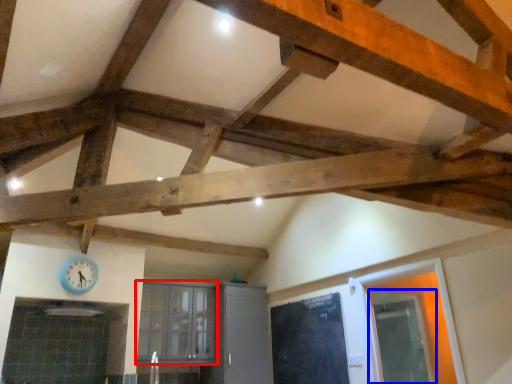
Question: Which of the following is the farthest to the observer, window (highlighted by a red box) or glass door (highlighted by a blue box)?

Choices:
 (A) window
 (B) glass door

Answer: (A)